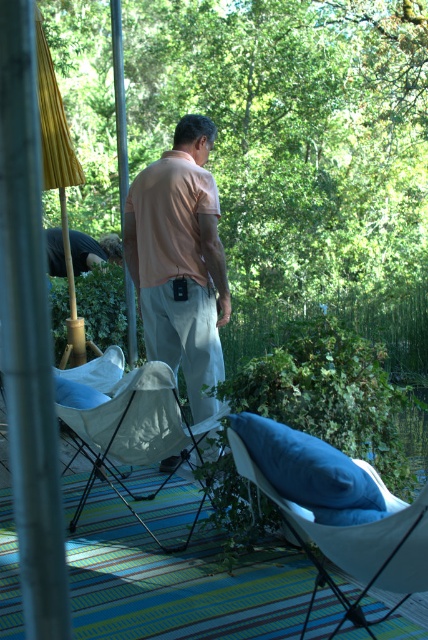
Is point (48, 380) positioned before point (323, 448)?

That is True.

Who is more distant from viewer, (x=30, y=419) or (x=294, y=486)?

Positioned behind is point (x=294, y=486).

Identify the location of silver metallic pole at left. (29, 336).

Who is lower down, matte khaki pants at center or blue soft pillow at lower center?

blue soft pillow at lower center is lower down.

Does matte khaki pants at center appear over blue soft pillow at lower center?

Yes, matte khaki pants at center is above blue soft pillow at lower center.

In order to click on matte khaki pants at center in this screenshot , I will do `click(180, 260)`.

Locate an element on the screen. This screenshot has height=640, width=428. matte khaki pants at center is located at coordinates (180, 260).

Between white fabric chair at center and metallic pole at upper center, which one is positioned higher?

metallic pole at upper center is above.

The image size is (428, 640). What do you see at coordinates (128, 426) in the screenshot?
I see `white fabric chair at center` at bounding box center [128, 426].

The width and height of the screenshot is (428, 640). Describe the element at coordinates (128, 426) in the screenshot. I see `white fabric chair at center` at that location.

Identify the location of white fabric chair at center. (128, 426).